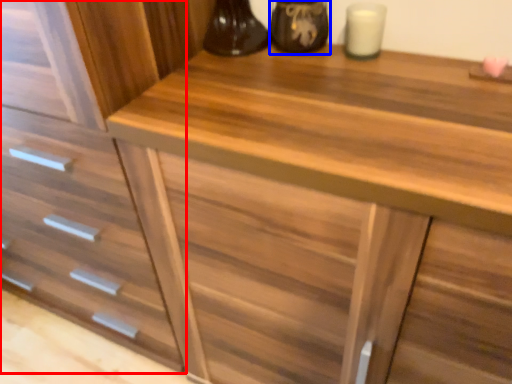
Question: Which point is closer to the camera, drawer (highlighted by a red box) or appliance (highlighted by a blue box)?

Choices:
 (A) drawer
 (B) appliance

Answer: (A)